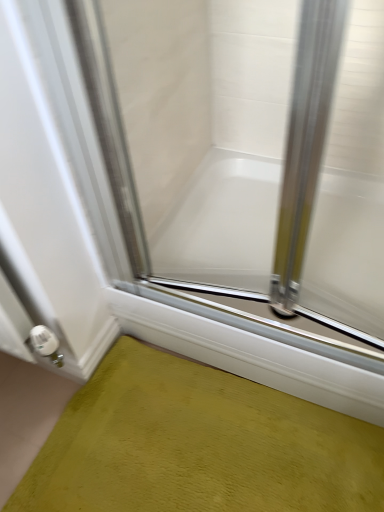
Question: Are clear glass door at center and green textured bath mat at lower left beside each other?

Choices:
 (A) yes
 (B) no

Answer: (B)

Question: Does clear glass door at center have a greater height compared to green textured bath mat at lower left?

Choices:
 (A) yes
 (B) no

Answer: (A)

Question: Is clear glass door at center shorter than green textured bath mat at lower left?

Choices:
 (A) no
 (B) yes

Answer: (A)

Question: Does clear glass door at center have a lesser width compared to green textured bath mat at lower left?

Choices:
 (A) no
 (B) yes

Answer: (B)

Question: Is clear glass door at center bigger than green textured bath mat at lower left?

Choices:
 (A) no
 (B) yes

Answer: (B)

Question: Considering the positions of green textured bath mat at lower left and clear glass door at center in the image, is green textured bath mat at lower left taller or shorter than clear glass door at center?

Choices:
 (A) short
 (B) tall

Answer: (A)

Question: Based on their positions, is green textured bath mat at lower left located to the left or right of clear glass door at center?

Choices:
 (A) right
 (B) left

Answer: (A)

Question: From a real-world perspective, is green textured bath mat at lower left above or below clear glass door at center?

Choices:
 (A) below
 (B) above

Answer: (A)

Question: Considering their positions, is green textured bath mat at lower left located in front of or behind clear glass door at center?

Choices:
 (A) front
 (B) behind

Answer: (B)

Question: In the image, is clear glass door at center positioned in front of or behind green textured bath mat at lower left?

Choices:
 (A) behind
 (B) front

Answer: (B)

Question: Is clear glass door at center spatially inside green textured bath mat at lower left, or outside of it?

Choices:
 (A) outside
 (B) inside

Answer: (A)

Question: Based on their sizes in the image, would you say clear glass door at center is bigger or smaller than green textured bath mat at lower left?

Choices:
 (A) small
 (B) big

Answer: (B)

Question: Considering the positions of clear glass door at center and green textured bath mat at lower left in the image, is clear glass door at center taller or shorter than green textured bath mat at lower left?

Choices:
 (A) tall
 (B) short

Answer: (A)

Question: Relative to white glossy bathtub at center, is green textured bath mat at lower left in front or behind?

Choices:
 (A) front
 (B) behind

Answer: (A)

Question: Considering the positions of point (302, 496) and point (345, 265), is point (302, 496) closer or farther from the camera than point (345, 265)?

Choices:
 (A) closer
 (B) farther

Answer: (A)